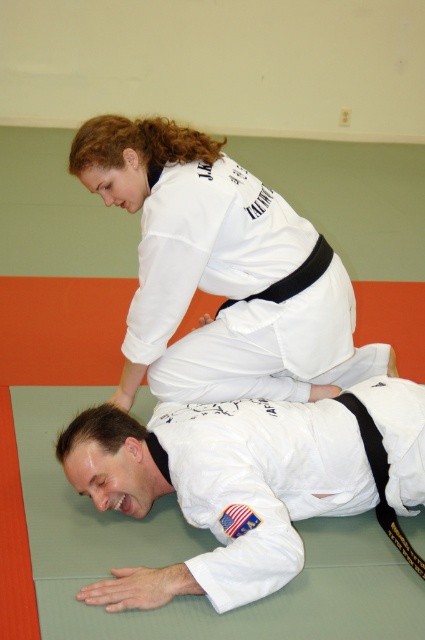
You are a beginner BJJ student observing the training session. You need to quickly identify which item is bigger between the white matte kimono at lower center and the black matte belt at center. Which one should you point out?

The white matte kimono at lower center is larger in size than the black matte belt at center, so you should point out the white matte kimono at lower center.